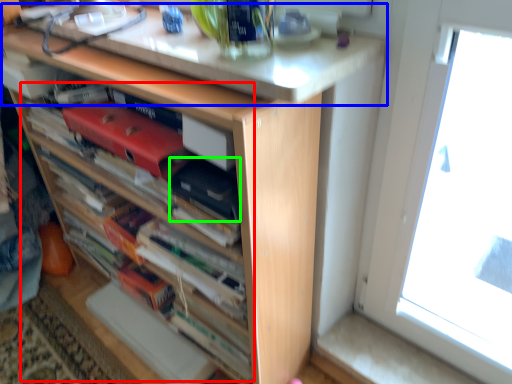
Question: Considering the real-world distances, which object is closest to book (highlighted by a red box)? counter top (highlighted by a blue box) or paperback book (highlighted by a green box).

Choices:
 (A) counter top
 (B) paperback book

Answer: (B)